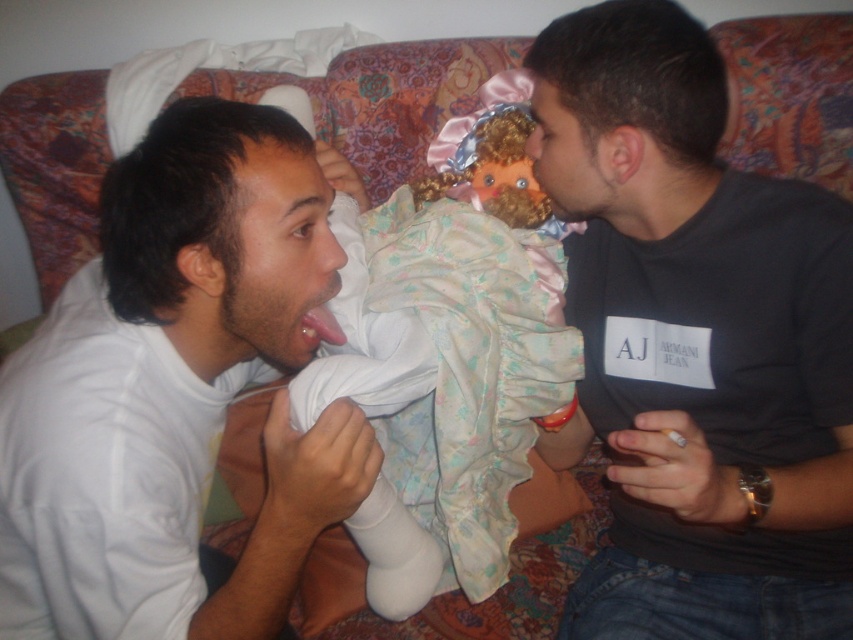
You are a photographer trying to capture a closeup of the silky pastel dress at center and the pink glossy tongue at center. Which object should you focus on first if you want to ensure both are in focus without moving the camera?

You should focus on the pink glossy tongue at center first because it is closer to the camera than the silky pastel dress at center. By focusing on the closer object, the farther object will also be in focus due to the depth of field.

You are a photographer trying to capture a closeup shot of the black matte shirt at center and the pink glossy tongue at center. Which object should you focus on first if you want to ensure both are in focus without adjusting the camera settings?

The black matte shirt at center is located below the pink glossy tongue at center, so you should focus on the pink glossy tongue at center first since it is closer to the camera. This way, the depth of field will cover both objects effectively.